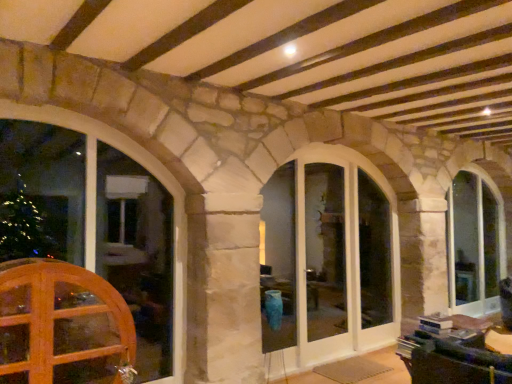
Question: Is clear glass window at right, the 1th window from the right, further to the viewer compared to wooden window at left, which appears as the first window when viewed from the left?

Choices:
 (A) yes
 (B) no

Answer: (A)

Question: Can you confirm if clear glass window at right, the first window viewed from the back, is taller than wooden window at left, the 1th window from the front?

Choices:
 (A) yes
 (B) no

Answer: (A)

Question: Does clear glass window at right, which is counted as the third window, starting from the left, have a larger size compared to wooden window at left, which appears as the first window when viewed from the left?

Choices:
 (A) yes
 (B) no

Answer: (A)

Question: From the image's perspective, is clear glass window at right, which is counted as the third window, starting from the left, beneath wooden window at left, the 1th window from the front?

Choices:
 (A) yes
 (B) no

Answer: (A)

Question: Can you confirm if clear glass window at right, the 1th window from the right, is wider than wooden window at left, which appears as the first window when viewed from the left?

Choices:
 (A) yes
 (B) no

Answer: (B)

Question: Can you confirm if clear glass window at right, which is counted as the third window, starting from the left, is positioned to the right of wooden window at left, the 1th window from the front?

Choices:
 (A) no
 (B) yes

Answer: (B)

Question: From the image's perspective, is clear glass window at right, the first window viewed from the back, located beneath white glass door at center?

Choices:
 (A) no
 (B) yes

Answer: (B)

Question: From a real-world perspective, is clear glass window at right, which is counted as the third window, starting from the left, located higher than white glass door at center?

Choices:
 (A) no
 (B) yes

Answer: (A)

Question: Considering the relative positions of clear glass window at right, the 1th window from the right, and white glass door at center in the image provided, is clear glass window at right, the 1th window from the right, in front of white glass door at center?

Choices:
 (A) no
 (B) yes

Answer: (A)

Question: From the image's perspective, does clear glass window at right, the first window viewed from the back, appear higher than white glass door at center?

Choices:
 (A) no
 (B) yes

Answer: (A)

Question: Is clear glass window at right, the first window viewed from the back, positioned far away from white glass door at center?

Choices:
 (A) yes
 (B) no

Answer: (A)

Question: Is clear glass window at right, which is counted as the third window, starting from the front, aimed at white glass door at center?

Choices:
 (A) yes
 (B) no

Answer: (B)

Question: Could you tell me if white glass door at center is facing wooden glass door at lower left?

Choices:
 (A) no
 (B) yes

Answer: (A)